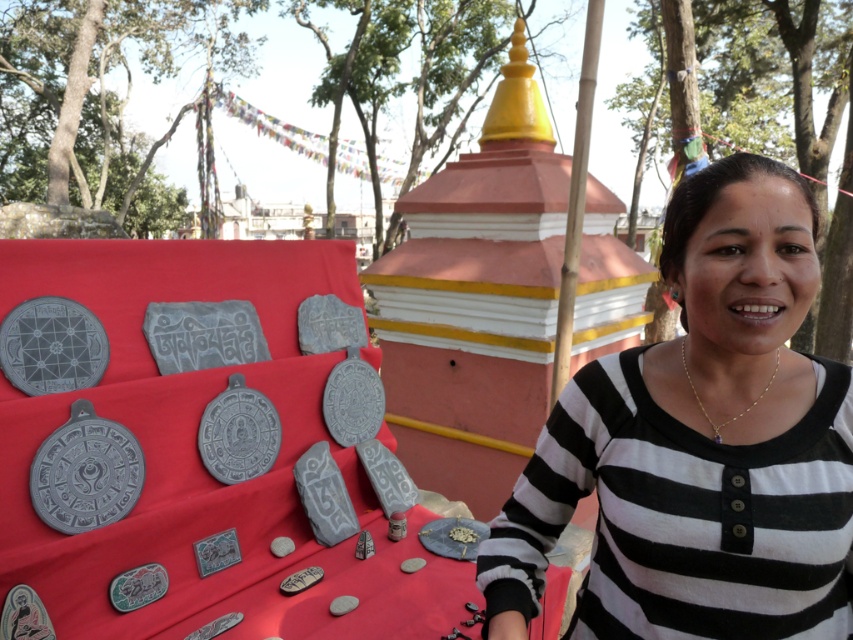
Question: Does black striped shirt at right appear over gold chain necklace at center?

Choices:
 (A) yes
 (B) no

Answer: (B)

Question: Is black striped shirt at right closer to the viewer compared to gold chain necklace at center?

Choices:
 (A) yes
 (B) no

Answer: (A)

Question: Which point is closer to the camera?

Choices:
 (A) (711, 225)
 (B) (691, 378)

Answer: (A)

Question: Does black striped shirt at right have a greater width compared to gold chain necklace at center?

Choices:
 (A) yes
 (B) no

Answer: (A)